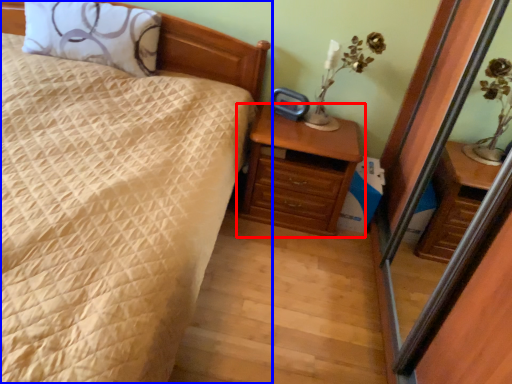
Question: Which of the following is the closest to the observer, chest of drawers (highlighted by a red box) or bed (highlighted by a blue box)?

Choices:
 (A) chest of drawers
 (B) bed

Answer: (B)